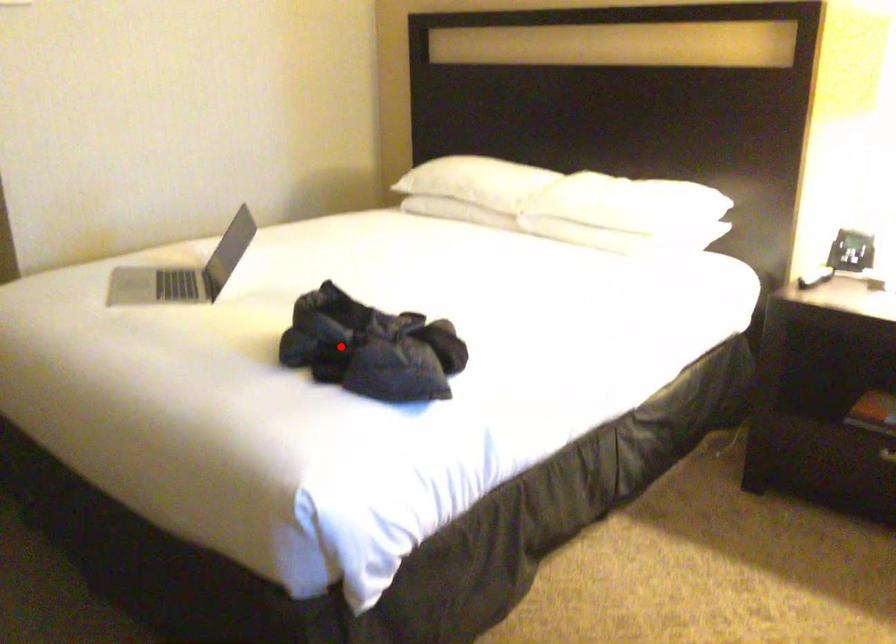
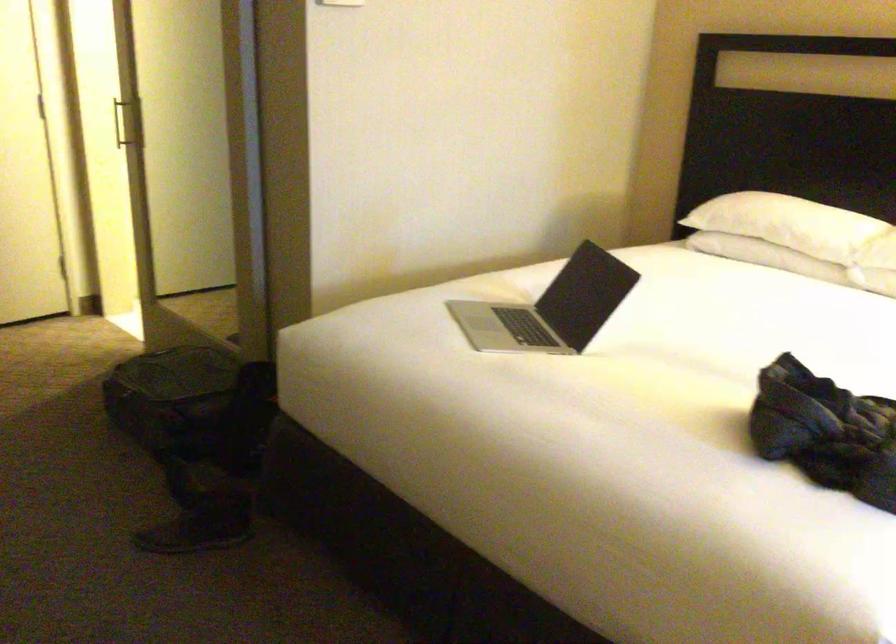
The point at the highlighted location is marked in the first image. Where is the corresponding point in the second image?

(825, 431)